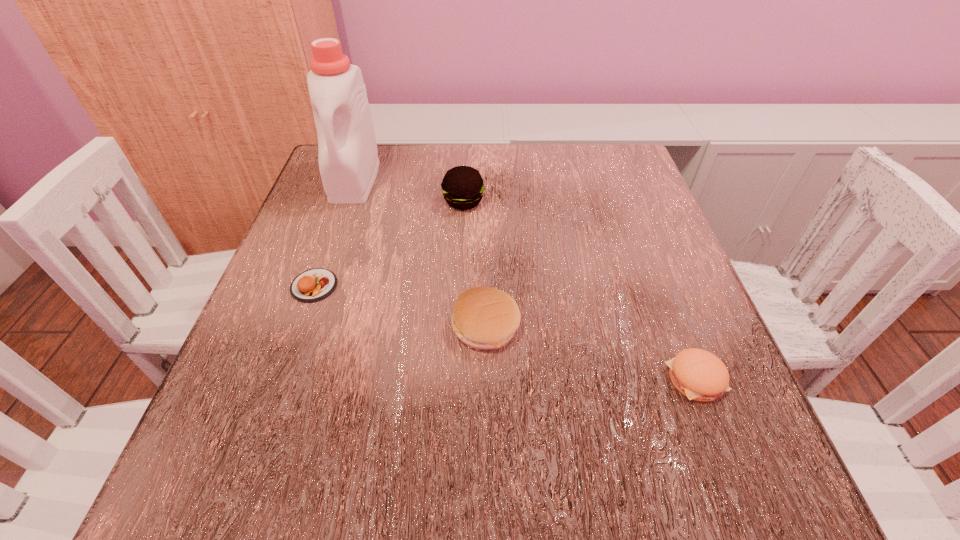
Locate an element on the screen. The width and height of the screenshot is (960, 540). the tallest object is located at coordinates 348,159.

The height and width of the screenshot is (540, 960). In order to click on the tallest patty (food) in this screenshot , I will do `click(462, 186)`.

Image resolution: width=960 pixels, height=540 pixels. I want to click on the fourth shortest object, so click(462, 186).

Where is `the second tallest patty (food)`? the second tallest patty (food) is located at coordinates (483, 317).

Locate an element on the screen. the rightmost object is located at coordinates (698, 374).

This screenshot has height=540, width=960. What are the coordinates of `the second shortest patty (food)` in the screenshot? It's located at (698, 374).

Where is `the shortest object`? This screenshot has height=540, width=960. the shortest object is located at coordinates (312, 285).

The image size is (960, 540). In order to click on the shortest patty (food) in this screenshot , I will do `click(312, 285)`.

Identify the location of vacant space positioned on the handle side of the detergent. (317, 288).

This screenshot has height=540, width=960. In order to click on vacant space situated 0.300m on the right of the second tallest object in this screenshot , I will do `click(623, 201)`.